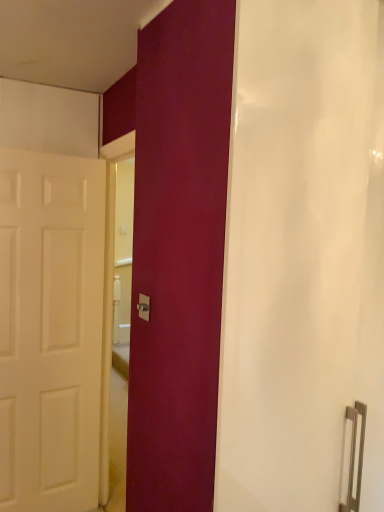
Question: From their relative heights in the image, would you say white matte door at left is taller or shorter than matte white shower curtain at center?

Choices:
 (A) short
 (B) tall

Answer: (B)

Question: Relative to matte white shower curtain at center, is white matte door at left in front or behind?

Choices:
 (A) behind
 (B) front

Answer: (A)

Question: Which object is positioned closest to the white matte door at left?

Choices:
 (A) matte silver switch at center
 (B) matte white shower curtain at center

Answer: (A)

Question: Which is nearer to the matte white shower curtain at center?

Choices:
 (A) matte silver switch at center
 (B) white matte door at left

Answer: (A)